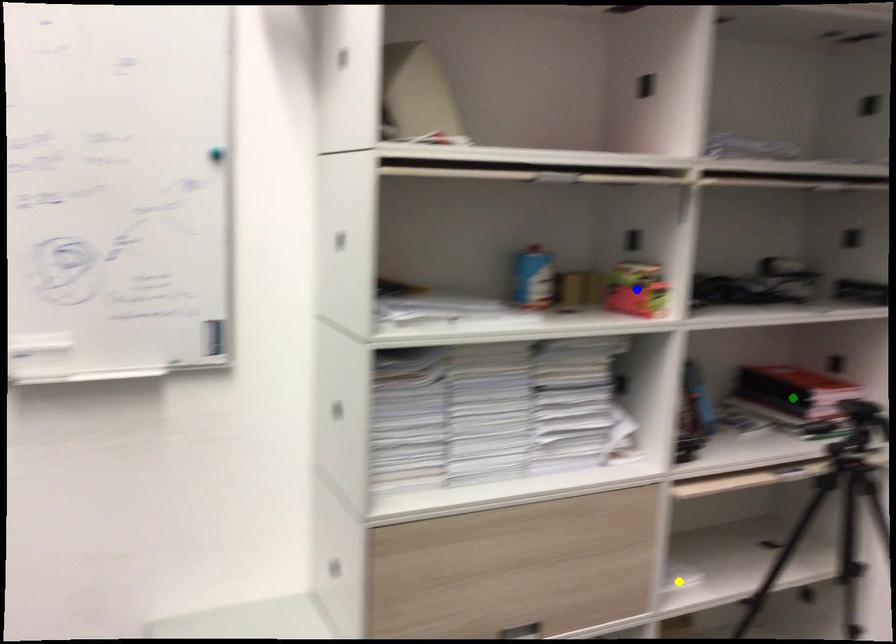
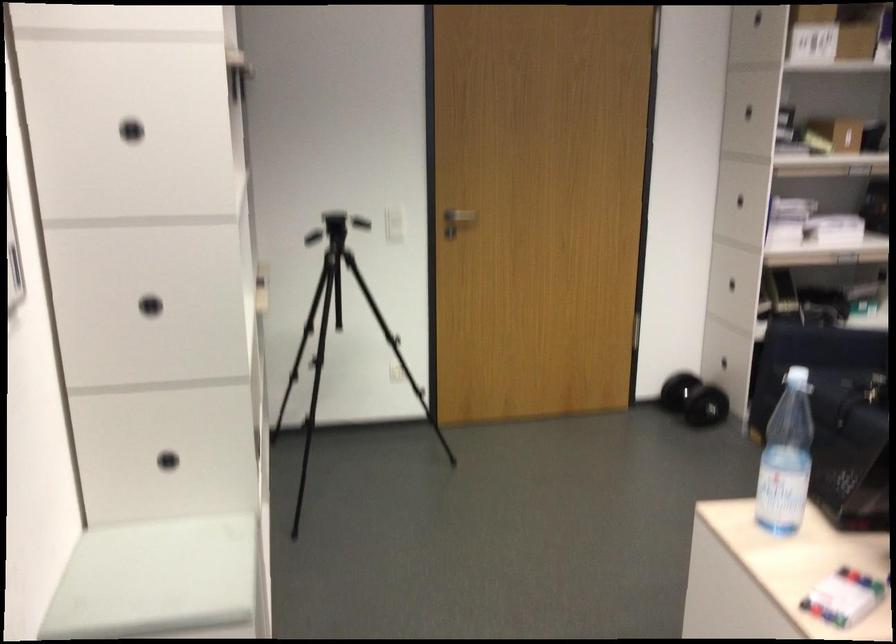
I am providing you with two images of the same scene from different viewpoints. Three points are marked in image1. Which point corresponds to a part or object that is occluded in image2?In image1, three points are marked. Which of them correspond to a part or object that is occluded in image2?Among the three points shown in image1, which one corresponds to a part or object that is no longer visible due to occlusion in image2?

blue point, yellow point, green point